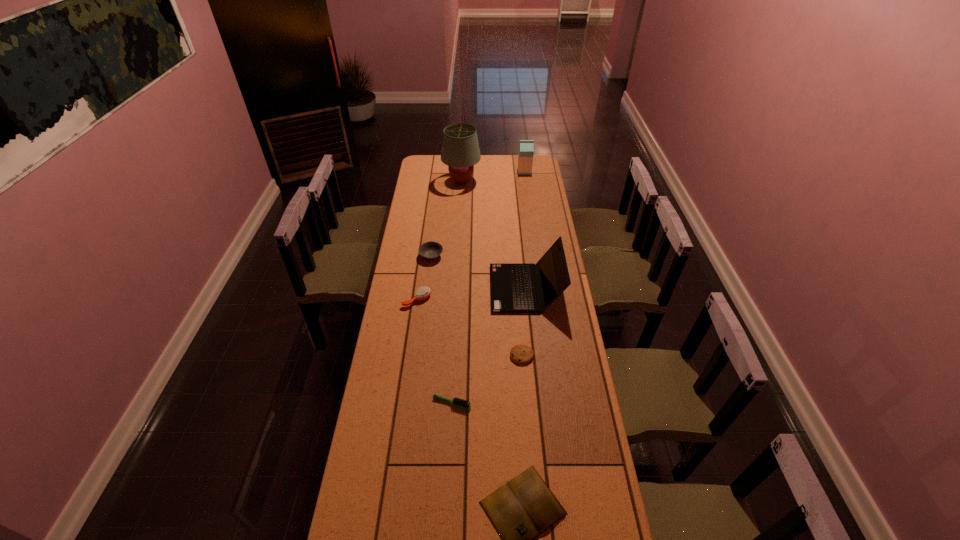
Find the location of a particular element. Image resolution: width=960 pixels, height=540 pixels. free space between the third nearest object and the milk carton is located at coordinates (523, 264).

The width and height of the screenshot is (960, 540). Find the location of `vacant area that lies between the milk carton and the bowl`. vacant area that lies between the milk carton and the bowl is located at coordinates (478, 214).

Image resolution: width=960 pixels, height=540 pixels. I want to click on free area in between the lampshade and the milk carton, so click(493, 177).

Image resolution: width=960 pixels, height=540 pixels. What are the coordinates of `free space between the cookie and the right hairbrush` in the screenshot? It's located at [487, 380].

Where is `free space between the cookie and the nearer hairbrush`? free space between the cookie and the nearer hairbrush is located at coordinates (487, 380).

Locate which object is the seventh closest to the book. Please provide its 2D coordinates. Your answer should be formatted as a tuple, i.e. [(x, y)], where the tuple contains the x and y coordinates of a point satisfying the conditions above.

[(526, 147)]

Find the location of a particular element. object that can be found as the seventh closest to the laptop computer is located at coordinates (526, 147).

In order to click on vacant point that satisfies the following two spatial constraints: 1. on the front side of the sixth farthest object; 2. on the right side of the lampshade in this screenshot , I will do `click(452, 355)`.